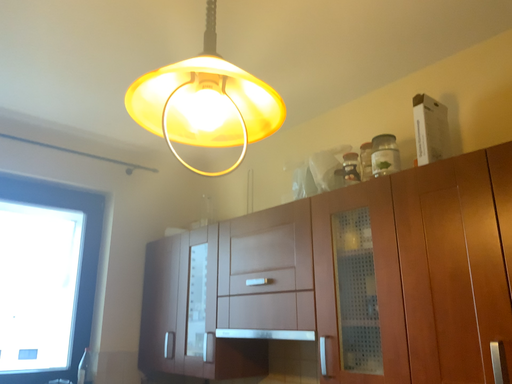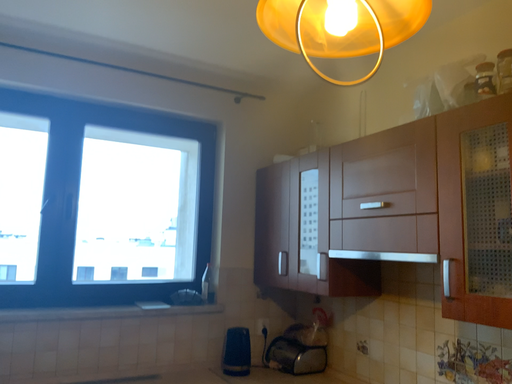
Question: Which way did the camera rotate in the video?

Choices:
 (A) rotated right
 (B) rotated left

Answer: (B)